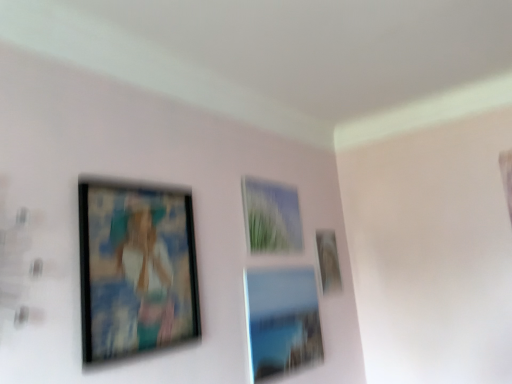
Question: Is matte black picture frame at left, the first picture frame in the left-to-right sequence, situated inside matte glass picture frame at upper right, marked as the first picture frame in a right-to-left arrangement, or outside?

Choices:
 (A) outside
 (B) inside

Answer: (A)

Question: From the image's perspective, is matte black picture frame at left, placed as the 4th picture frame when sorted from right to left, located above or below matte glass picture frame at upper right, the 4th picture frame positioned from the left?

Choices:
 (A) above
 (B) below

Answer: (A)

Question: Which of these objects is positioned closest to the matte glass picture frame at upper right, marked as the first picture frame in a right-to-left arrangement?

Choices:
 (A) matte glass picture frame at center, which ranks as the 2th picture frame in right-to-left order
 (B) matte black picture frame at left, placed as the 4th picture frame when sorted from right to left
 (C) matte glass picture frame at center, acting as the 2th picture frame starting from the left

Answer: (C)

Question: Estimate the real-world distances between objects in this image. Which object is farther from the matte glass picture frame at center, the third picture frame when ordered from right to left?

Choices:
 (A) matte glass picture frame at upper right, the 4th picture frame positioned from the left
 (B) matte glass picture frame at center, the third picture frame viewed from the left
 (C) matte black picture frame at left, the first picture frame in the left-to-right sequence

Answer: (C)